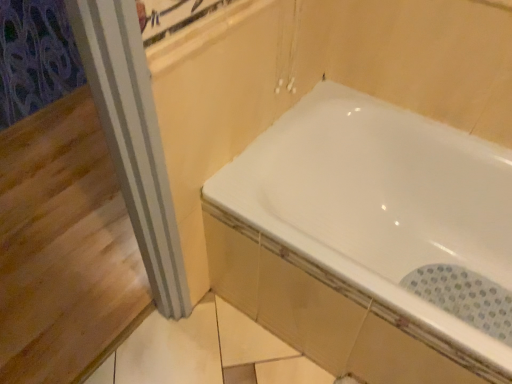
Where is `white glossy bathtub at center`? This screenshot has height=384, width=512. white glossy bathtub at center is located at coordinates (369, 240).

Describe the element at coordinates (369, 240) in the screenshot. The width and height of the screenshot is (512, 384). I see `white glossy bathtub at center` at that location.

What are the coordinates of `white glossy bathtub at center` in the screenshot? It's located at (369, 240).